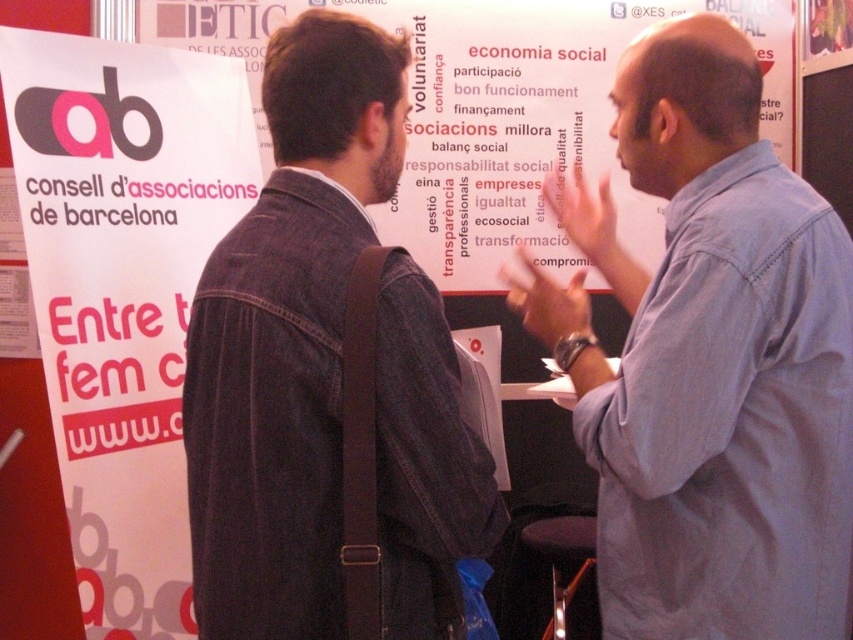
Question: Which of the following is the closest to the observer?

Choices:
 (A) (683, 502)
 (B) (90, 403)
 (C) (486, 65)

Answer: (A)

Question: Which is farther from the white paper at upper center?

Choices:
 (A) blue shirt at upper right
 (B) matte paper poster at left

Answer: (A)

Question: Can you confirm if denim jacket at center is smaller than white paper at upper center?

Choices:
 (A) yes
 (B) no

Answer: (A)

Question: Which of the following is the closest to the observer?

Choices:
 (A) white paper at upper center
 (B) matte paper poster at left
 (C) denim jacket at center
 (D) blue shirt at upper right

Answer: (C)

Question: Can you confirm if blue shirt at upper right is positioned to the right of denim jacket at center?

Choices:
 (A) no
 (B) yes

Answer: (B)

Question: Does denim jacket at center have a smaller size compared to white paper at upper center?

Choices:
 (A) no
 (B) yes

Answer: (B)